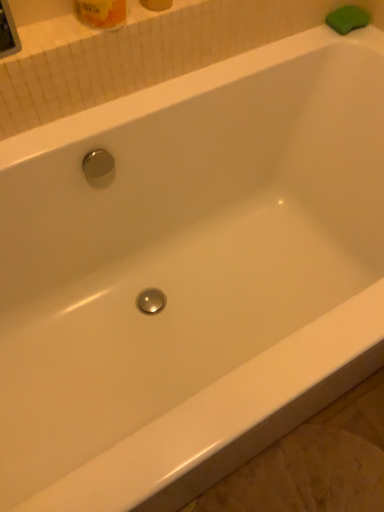
Image resolution: width=384 pixels, height=512 pixels. What do you see at coordinates (102, 13) in the screenshot?
I see `yellow matte bottle at upper left` at bounding box center [102, 13].

I want to click on yellow matte bottle at upper left, so click(102, 13).

Locate an element on the screen. yellow matte bottle at upper left is located at coordinates 102,13.